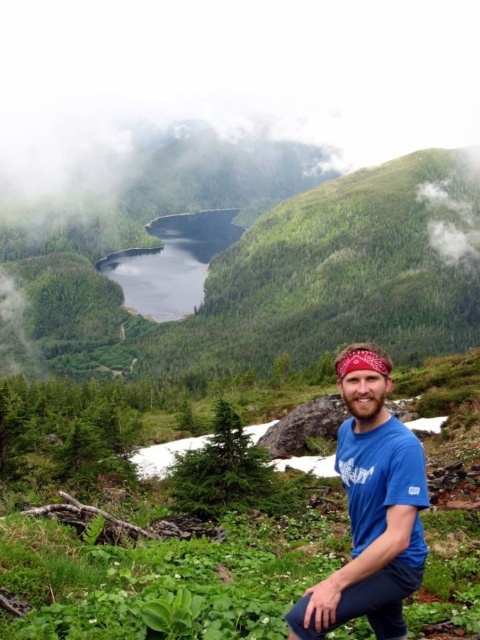
Does blue cotton shirt at center appear on the right side of deep blue water at center?

Yes, blue cotton shirt at center is to the right of deep blue water at center.

Is point (372, 468) positioned after point (164, 257)?

No, (372, 468) is closer to viewer.

Is point (358, 566) positioned behind point (204, 212)?

No, (358, 566) is in front of (204, 212).

Identify the location of blue cotton shirt at center. (371, 508).